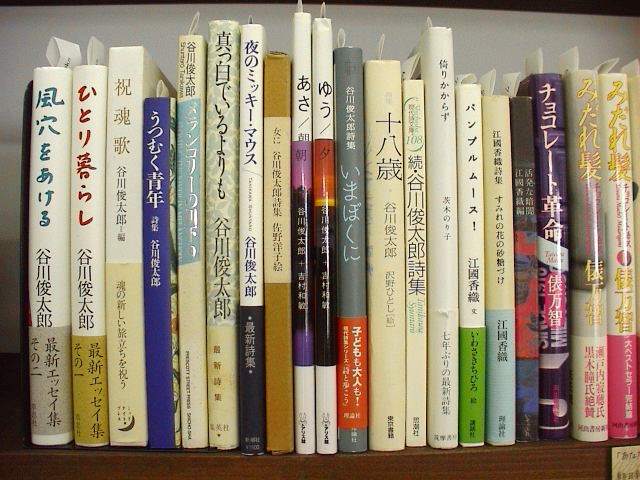
Locate an element on the screen. The image size is (640, 480). book shelf is located at coordinates (507, 458).